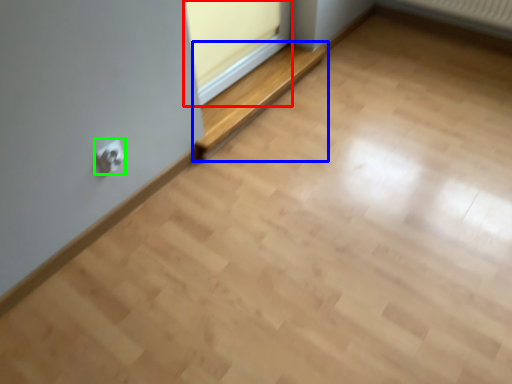
Question: Which is farther away from window frame (highlighted by a red box)? balustrade (highlighted by a blue box) or electric outlet (highlighted by a green box)?

Choices:
 (A) balustrade
 (B) electric outlet

Answer: (B)